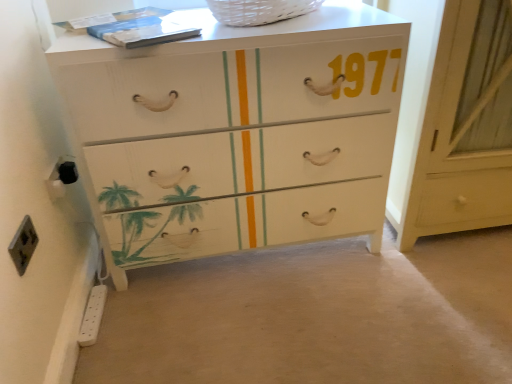
Question: Can you confirm if white painted wood chest of drawers at center is positioned to the right of black plastic socket at lower left, marked as the 3th electric outlet in a bottom-to-top arrangement?

Choices:
 (A) no
 (B) yes

Answer: (B)

Question: Is white painted wood chest of drawers at center looking in the opposite direction of black plastic socket at lower left, the 2th electric outlet in the back-to-front sequence?

Choices:
 (A) no
 (B) yes

Answer: (A)

Question: Does white painted wood chest of drawers at center lie in front of black plastic socket at lower left, the first electric outlet from the top?

Choices:
 (A) no
 (B) yes

Answer: (B)

Question: Is white painted wood chest of drawers at center wider than black plastic socket at lower left, marked as the 3th electric outlet in a bottom-to-top arrangement?

Choices:
 (A) yes
 (B) no

Answer: (A)

Question: Considering the relative positions of white painted wood chest of drawers at center and black plastic socket at lower left, marked as the 3th electric outlet in a bottom-to-top arrangement, in the image provided, is white painted wood chest of drawers at center behind black plastic socket at lower left, marked as the 3th electric outlet in a bottom-to-top arrangement,?

Choices:
 (A) yes
 (B) no

Answer: (B)

Question: Is point (57, 172) closer or farther from the camera than point (190, 87)?

Choices:
 (A) closer
 (B) farther

Answer: (B)

Question: Considering the positions of black plastic socket at lower left, the 2th electric outlet in the back-to-front sequence, and white painted wood chest of drawers at center in the image, is black plastic socket at lower left, the 2th electric outlet in the back-to-front sequence, bigger or smaller than white painted wood chest of drawers at center?

Choices:
 (A) small
 (B) big

Answer: (A)

Question: Is black plastic socket at lower left, the 2th electric outlet in the back-to-front sequence, to the left or to the right of white painted wood chest of drawers at center in the image?

Choices:
 (A) right
 (B) left

Answer: (B)

Question: Is black plastic socket at lower left, the 2th electric outlet when ordered from front to back, wider or thinner than white painted wood chest of drawers at center?

Choices:
 (A) thin
 (B) wide

Answer: (A)

Question: From a real-world perspective, is white plastic power strip at lower left, the 3th electric outlet viewed from the front, positioned above or below black plastic socket at lower left, the 2th electric outlet in the back-to-front sequence?

Choices:
 (A) below
 (B) above

Answer: (A)

Question: Would you say white plastic power strip at lower left, the 3th electric outlet positioned from the top, is to the left or to the right of black plastic socket at lower left, the 2th electric outlet in the back-to-front sequence, in the picture?

Choices:
 (A) left
 (B) right

Answer: (B)

Question: Choose the correct answer: Is white plastic power strip at lower left, placed as the 1th electric outlet when sorted from bottom to top, inside black plastic socket at lower left, marked as the 3th electric outlet in a bottom-to-top arrangement, or outside it?

Choices:
 (A) inside
 (B) outside

Answer: (B)

Question: Is point (106, 289) closer or farther from the camera than point (52, 188)?

Choices:
 (A) farther
 (B) closer

Answer: (A)

Question: Is white plastic power strip at lower left, the 3th electric outlet positioned from the top, taller or shorter than white wood cabinet at right?

Choices:
 (A) short
 (B) tall

Answer: (A)

Question: Looking at their shapes, would you say white plastic power strip at lower left, placed as the 1th electric outlet when sorted from bottom to top, is wider or thinner than white wood cabinet at right?

Choices:
 (A) thin
 (B) wide

Answer: (A)